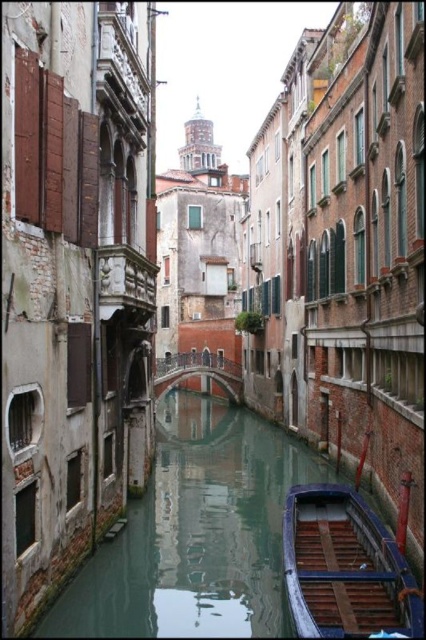
Does green smooth water at center appear over wooden boat at lower center?

No, green smooth water at center is not above wooden boat at lower center.

In the scene shown: Which is below, green smooth water at center or wooden boat at lower center?

green smooth water at center

Which is in front, point (209, 413) or point (354, 529)?

Point (354, 529) is in front.

This screenshot has width=426, height=640. Find the location of `green smooth water at center`. green smooth water at center is located at coordinates (195, 532).